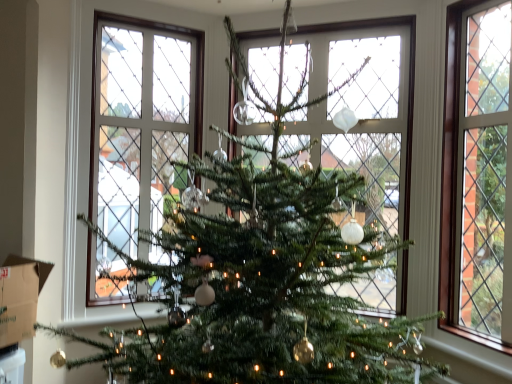
Question: Does clear glass window at right have a greater height compared to brown cardboard box at lower left?

Choices:
 (A) no
 (B) yes

Answer: (B)

Question: Is brown cardboard box at lower left at the back of clear glass window at right?

Choices:
 (A) no
 (B) yes

Answer: (A)

Question: Is clear glass window at right in front of brown cardboard box at lower left?

Choices:
 (A) yes
 (B) no

Answer: (B)

Question: Can you confirm if clear glass window at right is smaller than brown cardboard box at lower left?

Choices:
 (A) yes
 (B) no

Answer: (B)

Question: From a real-world perspective, is clear glass window at right over brown cardboard box at lower left?

Choices:
 (A) yes
 (B) no

Answer: (A)

Question: Is clear glass window at right wider than brown cardboard box at lower left?

Choices:
 (A) no
 (B) yes

Answer: (A)

Question: Is the position of brown cardboard box at lower left less distant than that of clear glass window at right?

Choices:
 (A) no
 (B) yes

Answer: (B)

Question: From the image's perspective, is brown cardboard box at lower left above clear glass window at right?

Choices:
 (A) yes
 (B) no

Answer: (B)

Question: Considering the relative sizes of brown cardboard box at lower left and clear glass window at right in the image provided, is brown cardboard box at lower left taller than clear glass window at right?

Choices:
 (A) yes
 (B) no

Answer: (B)

Question: Could you tell me if brown cardboard box at lower left is turned towards clear glass window at right?

Choices:
 (A) yes
 (B) no

Answer: (B)

Question: Is brown cardboard box at lower left to the left of clear glass window at right from the viewer's perspective?

Choices:
 (A) yes
 (B) no

Answer: (A)

Question: Does brown cardboard box at lower left lie behind clear glass window at right?

Choices:
 (A) no
 (B) yes

Answer: (A)

Question: Is brown cardboard box at lower left wider or thinner than clear glass window at right?

Choices:
 (A) wide
 (B) thin

Answer: (A)